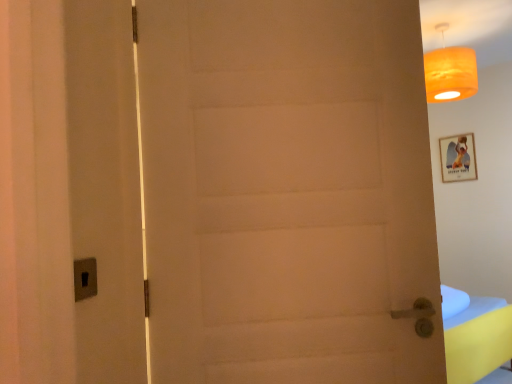
Question: Is white matte door at center wider or thinner than orange fabric lampshade at upper right?

Choices:
 (A) wide
 (B) thin

Answer: (B)

Question: In terms of size, does white matte door at center appear bigger or smaller than orange fabric lampshade at upper right?

Choices:
 (A) big
 (B) small

Answer: (A)

Question: Estimate the real-world distances between objects in this image. Which object is closer to the wooden framed picture at upper right?

Choices:
 (A) orange fabric lampshade at upper right
 (B) white matte door at center

Answer: (A)

Question: Based on their relative distances, which object is farther from the orange fabric lampshade at upper right?

Choices:
 (A) wooden framed picture at upper right
 (B) white matte door at center

Answer: (B)